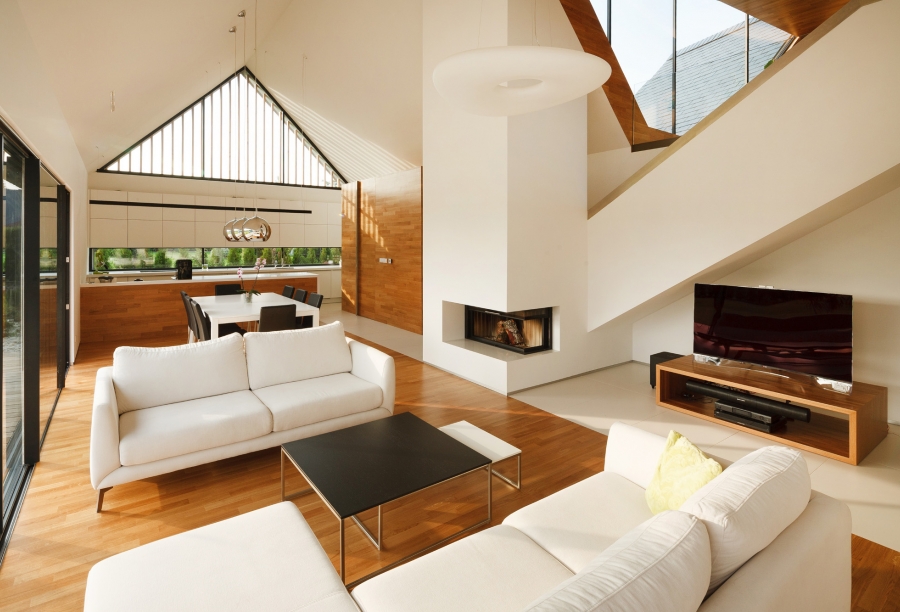
Find the location of a particular element. This screenshot has width=900, height=612. television is located at coordinates (754, 349).